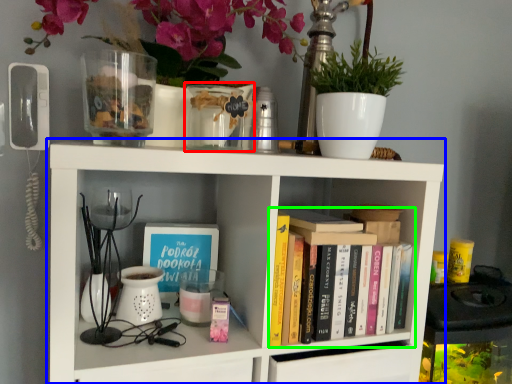
Question: Based on their relative distances, which object is nearer to glass vase (highlighted by a red box)? Choose from shelf (highlighted by a blue box) and book (highlighted by a green box).

Choices:
 (A) shelf
 (B) book

Answer: (A)